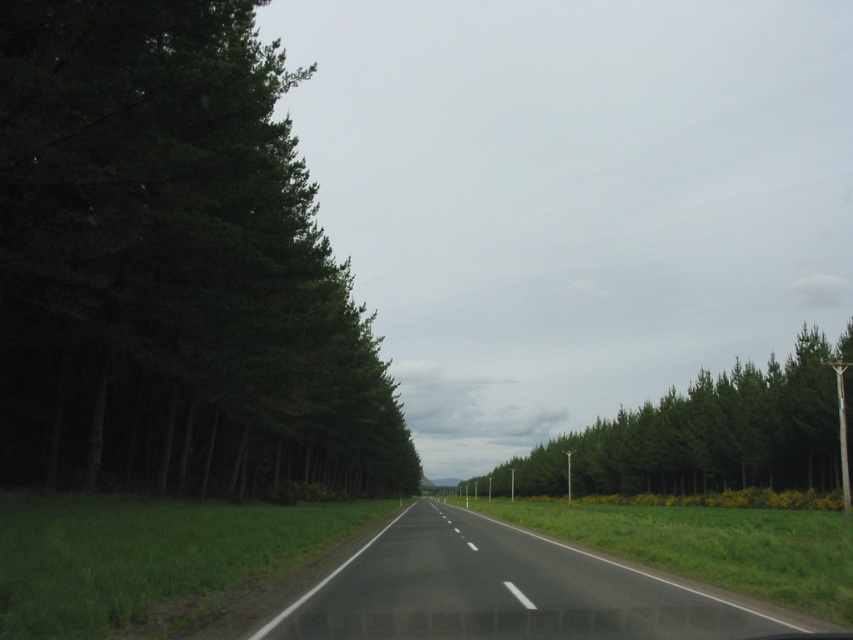
You are driving a car with a 4.5 meters length. You want to park your car so that its front bumper aligns with point (x=235, y=129). Is there enough space to park your car without overlapping any other objects?

The distance between point (x=235, y=129) and the camera is 17.05 meters. Since the car is only 4.5 meters long, there is sufficient space to park the car without overlapping any objects as the available space is more than double the car length.

You are driving along the road and want to make sure you stay within the right lane. The dark green textured trees at left are at point (173,268). Where should you position your car relative to this point to stay in the right lane?

The dark green textured trees at left are located at point (173,268). To stay in the right lane, you should position your car to the right of this point, keeping the trees on your left side while following the road markings.